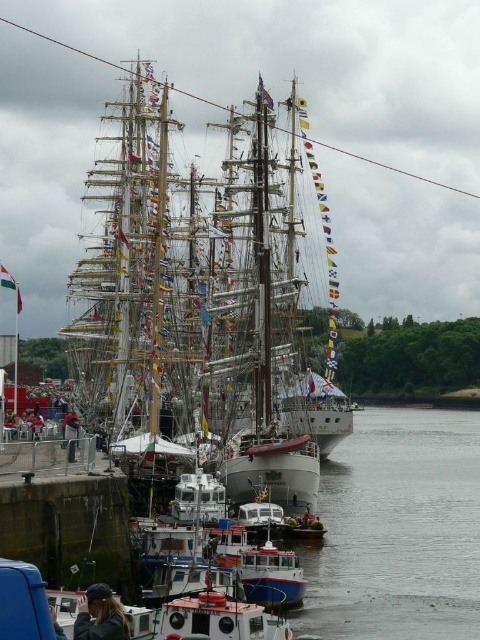
Question: Is white wooden ship at center to the right of dark brown leather jacket at lower left from the viewer's perspective?

Choices:
 (A) no
 (B) yes

Answer: (A)

Question: Among these objects, which one is farthest from the camera?

Choices:
 (A) white wooden ship at center
 (B) dark brown leather jacket at lower left

Answer: (A)

Question: Does white wooden ship at center appear on the right side of dark brown leather jacket at lower left?

Choices:
 (A) no
 (B) yes

Answer: (A)

Question: Which object is closer to the camera taking this photo?

Choices:
 (A) dark brown leather jacket at lower left
 (B) white wooden ship at center

Answer: (A)

Question: Which of the following is the closest to the observer?

Choices:
 (A) white wooden ship at center
 (B) dark brown leather jacket at lower left

Answer: (B)

Question: Is white wooden ship at center below dark brown leather jacket at lower left?

Choices:
 (A) no
 (B) yes

Answer: (A)